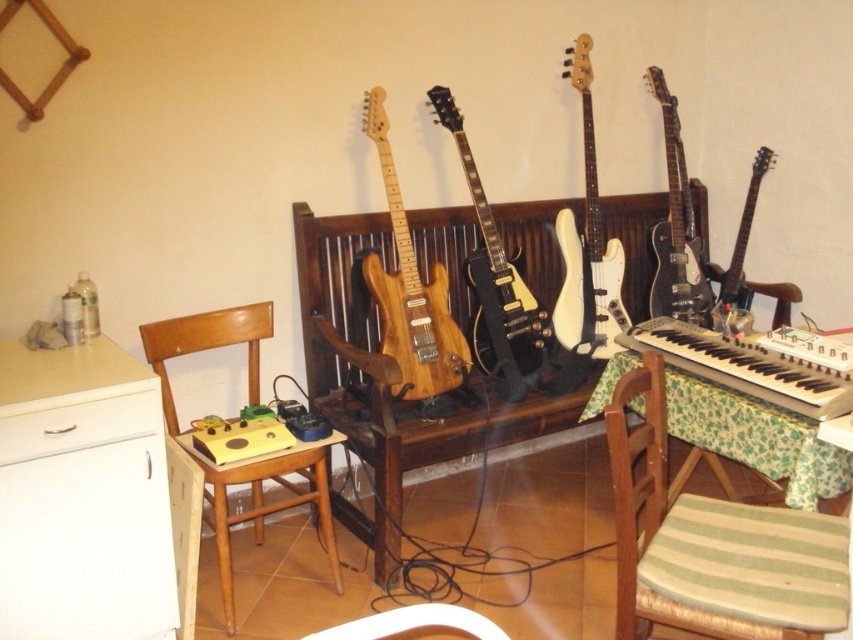
Does green striped fabric chair at lower right appear under glossy black electric guitar at center?

Indeed, green striped fabric chair at lower right is positioned under glossy black electric guitar at center.

Can you confirm if green striped fabric chair at lower right is positioned to the right of glossy black electric guitar at center?

Yes, green striped fabric chair at lower right is to the right of glossy black electric guitar at center.

Between point (657, 506) and point (480, 339), which one is positioned behind?

The point (480, 339) is behind.

Locate an element on the screen. The image size is (853, 640). green striped fabric chair at lower right is located at coordinates (717, 545).

Does white matte bass guitar at center appear on the left side of white plastic chair at lower center?

No, white matte bass guitar at center is not to the left of white plastic chair at lower center.

Is point (566, 236) in front of point (450, 625)?

No, it is not.

Is point (569, 328) positioned before point (502, 637)?

No, (569, 328) is further to viewer.

Locate an element on the screen. This screenshot has width=853, height=640. white matte bass guitar at center is located at coordinates (587, 244).

Which of these two, wooden chair at left or glossy black electric guitar at right, stands shorter?

Standing shorter between the two is glossy black electric guitar at right.

Which of these two, wooden chair at left or glossy black electric guitar at right, stands taller?

wooden chair at left

This screenshot has height=640, width=853. What are the coordinates of `wooden chair at left` in the screenshot? It's located at (241, 460).

The image size is (853, 640). Identify the location of wooden chair at left. (241, 460).